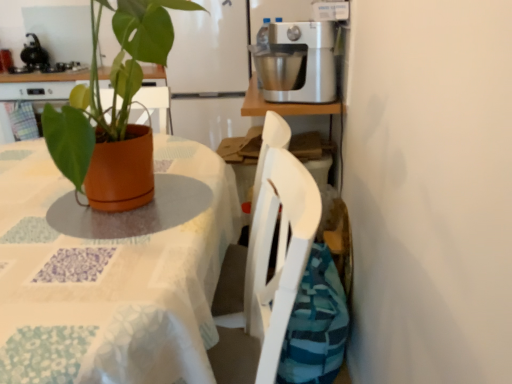
Question: Is the position of terracotta pot at center more distant than that of terracotta pot at left?

Choices:
 (A) yes
 (B) no

Answer: (A)

Question: Could you tell me if terracotta pot at center is turned towards terracotta pot at left?

Choices:
 (A) yes
 (B) no

Answer: (B)

Question: From the image's perspective, is terracotta pot at center above terracotta pot at left?

Choices:
 (A) no
 (B) yes

Answer: (B)

Question: Can you confirm if terracotta pot at center is positioned to the right of terracotta pot at left?

Choices:
 (A) no
 (B) yes

Answer: (B)

Question: Is terracotta pot at center in front of terracotta pot at left?

Choices:
 (A) yes
 (B) no

Answer: (B)

Question: From a real-world perspective, is terracotta pot at left positioned above or below satin silver mixer at upper right?

Choices:
 (A) above
 (B) below

Answer: (B)

Question: In terms of height, does terracotta pot at left look taller or shorter compared to satin silver mixer at upper right?

Choices:
 (A) short
 (B) tall

Answer: (B)

Question: From the image's perspective, is terracotta pot at left positioned above or below satin silver mixer at upper right?

Choices:
 (A) below
 (B) above

Answer: (A)

Question: Is terracotta pot at left situated inside satin silver mixer at upper right or outside?

Choices:
 (A) outside
 (B) inside

Answer: (A)

Question: From the image's perspective, is brushed metal mixer at upper center located above or below terracotta pot at left?

Choices:
 (A) below
 (B) above

Answer: (B)

Question: Considering the positions of brushed metal mixer at upper center and terracotta pot at left in the image, is brushed metal mixer at upper center wider or thinner than terracotta pot at left?

Choices:
 (A) wide
 (B) thin

Answer: (B)

Question: Considering their positions, is brushed metal mixer at upper center located in front of or behind terracotta pot at left?

Choices:
 (A) behind
 (B) front

Answer: (A)

Question: Looking at the image, does brushed metal mixer at upper center seem bigger or smaller compared to terracotta pot at left?

Choices:
 (A) small
 (B) big

Answer: (A)

Question: Does point (159, 145) appear closer or farther from the camera than point (20, 59)?

Choices:
 (A) closer
 (B) farther

Answer: (A)

Question: Do you think terracotta pot at left is within brushed metal mixer at upper center, or outside of it?

Choices:
 (A) inside
 (B) outside

Answer: (B)